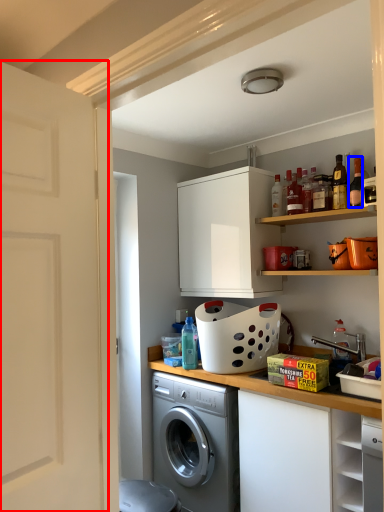
Question: Among these objects, which one is farthest to the camera, door (highlighted by a red box) or bottle (highlighted by a blue box)?

Choices:
 (A) door
 (B) bottle

Answer: (B)